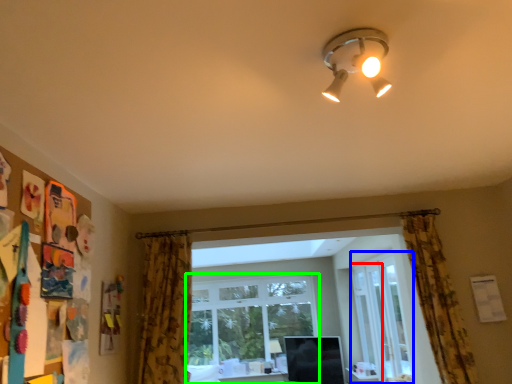
Question: Which object is positioned closest to screen door (highlighted by a red box)? Select from glass door (highlighted by a blue box) and window (highlighted by a green box).

Choices:
 (A) glass door
 (B) window

Answer: (A)